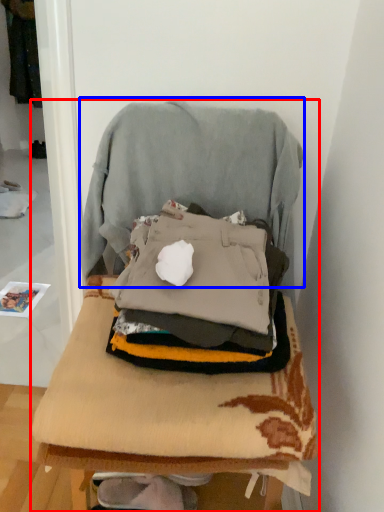
Question: Which of the following is the farthest to the observer, furniture (highlighted by a red box) or swivel chair (highlighted by a blue box)?

Choices:
 (A) furniture
 (B) swivel chair

Answer: (B)